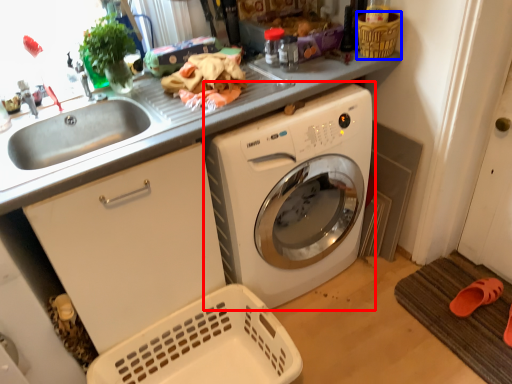
Question: Which point is closer to the camera, washing machine (highlighted by a red box) or basket (highlighted by a blue box)?

Choices:
 (A) washing machine
 (B) basket

Answer: (A)